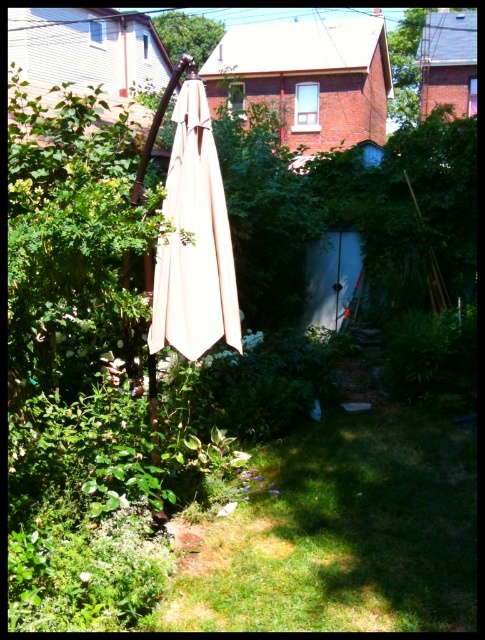
Question: Is beige fabric umbrella at center to the right of green leafy tree at upper center from the viewer's perspective?

Choices:
 (A) yes
 (B) no

Answer: (A)

Question: Which point is closer to the camera?

Choices:
 (A) (191, 182)
 (B) (162, 22)

Answer: (A)

Question: Observing the image, what is the correct spatial positioning of beige fabric umbrella at center in reference to green leafy tree at upper center?

Choices:
 (A) right
 (B) left

Answer: (A)

Question: Considering the relative positions of beige fabric umbrella at center and green leafy tree at upper center in the image provided, where is beige fabric umbrella at center located with respect to green leafy tree at upper center?

Choices:
 (A) right
 (B) left

Answer: (A)